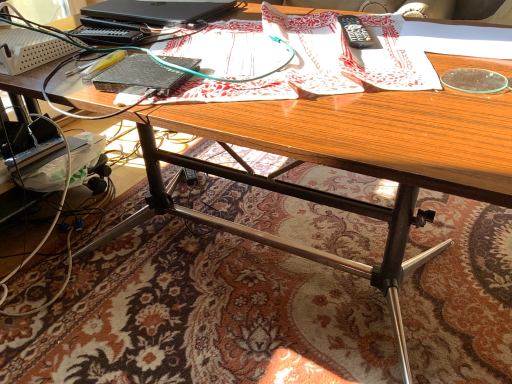
I want to click on free space below patterned paper at center (from a real-world perspective), so click(271, 59).